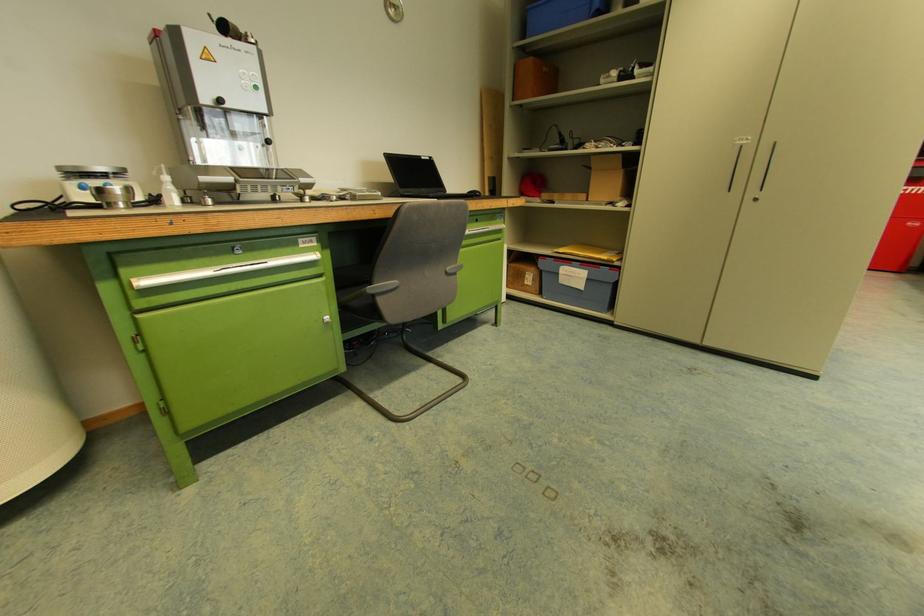
Find where to insert the green cabinet lock. Please return your answer as a coordinate pair (x, y).

(327, 321)